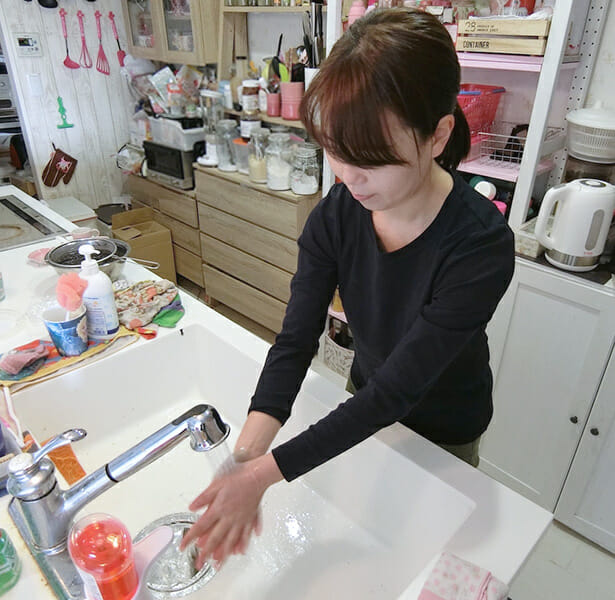
Locate an element on the screen. tea pot is located at coordinates (564, 230).